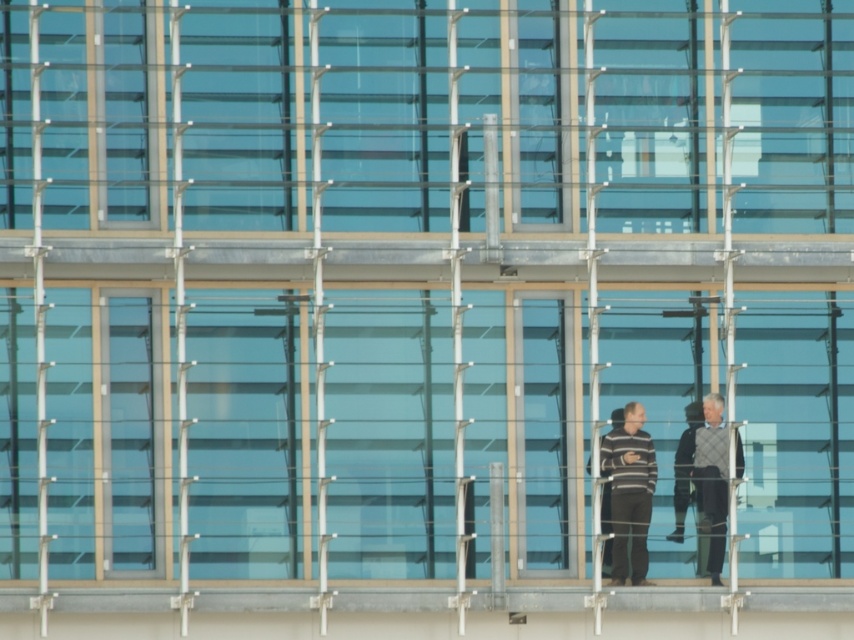
Consider the image. You are an interior designer observing the modern architectural structure. You notice two sweaters at the center of the image. Which sweater is closer to you, the striped sweater at center or the knitted sweater at center?

The striped sweater at center is closer to you because it is further to the viewer than the knitted sweater at center.

You are a photographer standing at the base of the building and want to capture a clear photo of the striped sweater at center on the balcony. Considering the distance, is it possible to take a clear photo without zooming in?

The striped sweater at center is 28.23 meters away from the camera. Without zooming in, capturing a clear photo at this distance may be challenging due to the significant distance involved.

You are an interior designer assessing the spatial compatibility of two sweaters displayed on a modern glass structure. The knitted sweater at center and the gray wool sweater at center are both on display. Based on their sizes, which sweater would require more vertical space to be properly displayed?

The knitted sweater at center requires more vertical space because it is taller than the gray wool sweater at center.